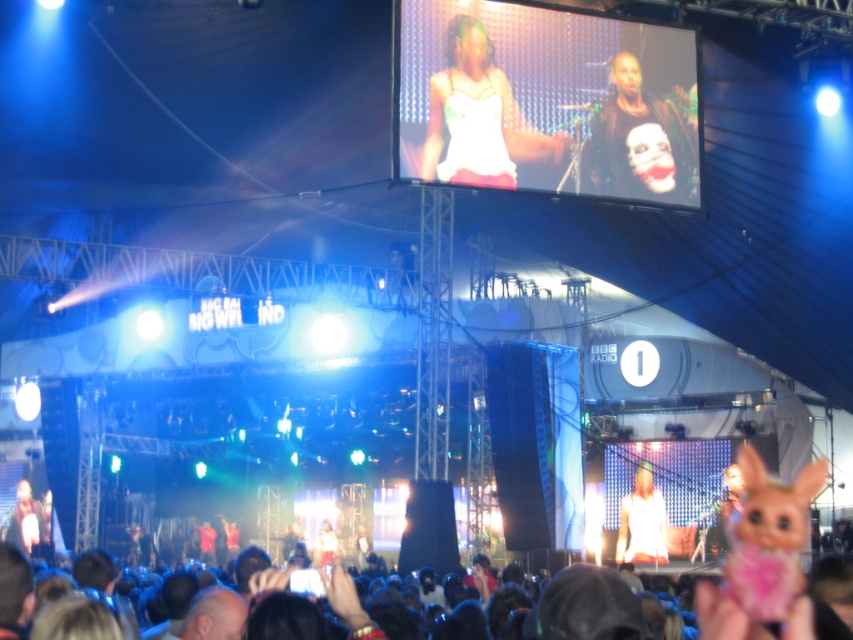
You are a photographer at the concert. You want to take a photo of the matte black laptop at lower left without the dark brown hair at lower center blocking it. What should you do?

The dark brown hair at lower center is in front of the matte black laptop at lower left, so you should move your position to the side or behind to avoid the obstruction caused by the dark brown hair at lower center.

You are a photographer at the concert and want to capture a photo of the white matte shirt at center without the matte black screen at upper center blocking it. Is this possible?

The matte black screen at upper center is positioned over the white matte shirt at center, so it will block the view. To capture the white matte shirt at center without obstruction, you would need to adjust your angle or position to avoid the screen.